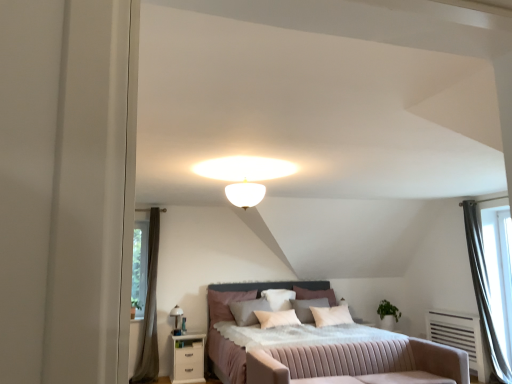
Question: Is white glass ceiling light at center looking in the opposite direction of velvet-like pink pillow at center, which is the first pillow from left to right?

Choices:
 (A) no
 (B) yes

Answer: (A)

Question: Is white glass ceiling light at center thinner than velvet-like pink pillow at center, which is the first pillow from left to right?

Choices:
 (A) no
 (B) yes

Answer: (A)

Question: Is velvet-like pink pillow at center, which is the first pillow from left to right, inside white glass ceiling light at center?

Choices:
 (A) yes
 (B) no

Answer: (B)

Question: Can you confirm if white glass ceiling light at center is positioned to the left of velvet-like pink pillow at center, which is the first pillow from left to right?

Choices:
 (A) no
 (B) yes

Answer: (A)

Question: Is white glass ceiling light at center in front of velvet-like pink pillow at center, which is the first pillow from left to right?

Choices:
 (A) yes
 (B) no

Answer: (A)

Question: Considering the relative positions of brown fabric curtain at left, which is counted as the 2th curtain, starting from the right, and white glossy nightstand at lower left in the image provided, is brown fabric curtain at left, which is counted as the 2th curtain, starting from the right, to the left or to the right of white glossy nightstand at lower left?

Choices:
 (A) left
 (B) right

Answer: (A)

Question: From the image's perspective, is brown fabric curtain at left, which is counted as the 2th curtain, starting from the right, above or below white glossy nightstand at lower left?

Choices:
 (A) above
 (B) below

Answer: (A)

Question: Is brown fabric curtain at left, which is counted as the 2th curtain, starting from the right, inside or outside of white glossy nightstand at lower left?

Choices:
 (A) outside
 (B) inside

Answer: (A)

Question: Considering their positions, is brown fabric curtain at left, the first curtain in the left-to-right sequence, located in front of or behind white glossy nightstand at lower left?

Choices:
 (A) front
 (B) behind

Answer: (B)

Question: Considering the positions of point (228, 324) and point (482, 311), is point (228, 324) closer or farther from the camera than point (482, 311)?

Choices:
 (A) closer
 (B) farther

Answer: (B)

Question: Considering the positions of pink fabric bed at center and silvery metallic curtain at right, which is counted as the second curtain, starting from the left, in the image, is pink fabric bed at center wider or thinner than silvery metallic curtain at right, which is counted as the second curtain, starting from the left,?

Choices:
 (A) thin
 (B) wide

Answer: (B)

Question: Based on their sizes in the image, would you say pink fabric bed at center is bigger or smaller than silvery metallic curtain at right, which is the 1th curtain in right-to-left order?

Choices:
 (A) small
 (B) big

Answer: (B)

Question: Choose the correct answer: Is pink fabric bed at center inside silvery metallic curtain at right, which is the 1th curtain in right-to-left order, or outside it?

Choices:
 (A) inside
 (B) outside

Answer: (B)

Question: From a real-world perspective, is pink fabric swivel chair at center physically located above or below silvery metallic curtain at right, which is the 1th curtain in right-to-left order?

Choices:
 (A) above
 (B) below

Answer: (B)

Question: Considering their positions, is pink fabric swivel chair at center located in front of or behind silvery metallic curtain at right, which is counted as the second curtain, starting from the left?

Choices:
 (A) behind
 (B) front

Answer: (B)